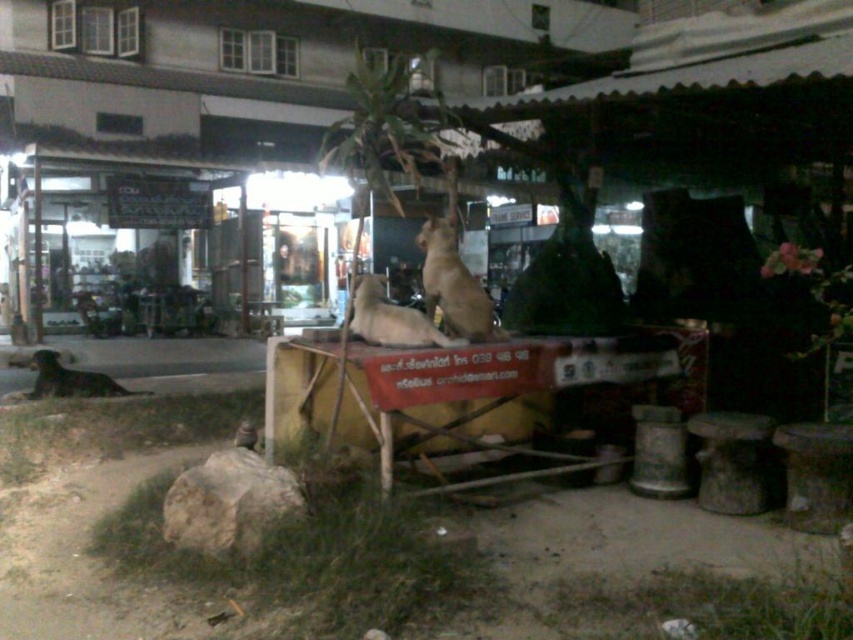
Can you confirm if fuzzy beige dog at center is positioned below brown fur dog at lower left?

No, fuzzy beige dog at center is not below brown fur dog at lower left.

What do you see at coordinates (392, 317) in the screenshot? The image size is (853, 640). I see `fuzzy beige dog at center` at bounding box center [392, 317].

Is point (413, 317) closer to viewer compared to point (109, 394)?

Yes, it is.

Find the location of a particular element. This screenshot has height=640, width=853. fuzzy beige dog at center is located at coordinates (392, 317).

In the scene shown: Does brown fur dog at center appear on the right side of brown fur dog at lower left?

Result: Yes, brown fur dog at center is to the right of brown fur dog at lower left.

At what (x,y) coordinates should I click in order to perform the action: click on brown fur dog at center. Please return your answer as a coordinate pair (x, y). The width and height of the screenshot is (853, 640). Looking at the image, I should click on (451, 284).

Where is `brown fur dog at center`? Image resolution: width=853 pixels, height=640 pixels. brown fur dog at center is located at coordinates (451, 284).

Does point (466, 273) come behind point (370, 332)?

Yes.

Does brown fur dog at center have a greater width compared to fuzzy beige dog at center?

No.

In order to click on brown fur dog at center in this screenshot , I will do `click(451, 284)`.

Locate an element on the screen. brown fur dog at center is located at coordinates (451, 284).